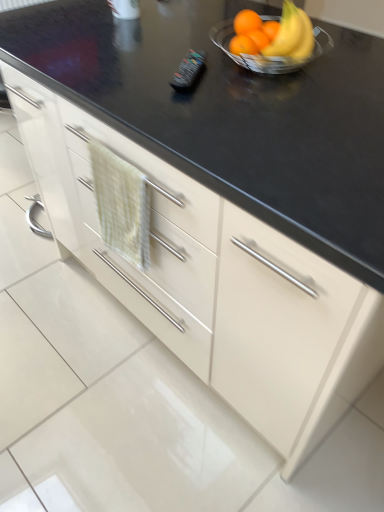
Question: Considering the relative sizes of black plastic remote control at center and shiny metallic bowl at upper right in the image provided, is black plastic remote control at center wider than shiny metallic bowl at upper right?

Choices:
 (A) no
 (B) yes

Answer: (A)

Question: Is black plastic remote control at center behind shiny metallic bowl at upper right?

Choices:
 (A) no
 (B) yes

Answer: (B)

Question: Is black plastic remote control at center with shiny metallic bowl at upper right?

Choices:
 (A) yes
 (B) no

Answer: (B)

Question: Does black plastic remote control at center have a lesser height compared to shiny metallic bowl at upper right?

Choices:
 (A) no
 (B) yes

Answer: (B)

Question: Does black plastic remote control at center turn towards shiny metallic bowl at upper right?

Choices:
 (A) no
 (B) yes

Answer: (A)

Question: Is black plastic remote control at center to the right of shiny metallic bowl at upper right from the viewer's perspective?

Choices:
 (A) yes
 (B) no

Answer: (B)

Question: Can you confirm if orange matte at upper right is thinner than shiny metallic bowl at upper right?

Choices:
 (A) yes
 (B) no

Answer: (A)

Question: Considering the relative sizes of orange matte at upper right and shiny metallic bowl at upper right in the image provided, is orange matte at upper right bigger than shiny metallic bowl at upper right?

Choices:
 (A) no
 (B) yes

Answer: (A)

Question: Can we say orange matte at upper right lies outside shiny metallic bowl at upper right?

Choices:
 (A) no
 (B) yes

Answer: (B)

Question: From a real-world perspective, does orange matte at upper right stand above shiny metallic bowl at upper right?

Choices:
 (A) no
 (B) yes

Answer: (A)

Question: Can you confirm if orange matte at upper right is shorter than shiny metallic bowl at upper right?

Choices:
 (A) no
 (B) yes

Answer: (B)

Question: Are orange matte at upper right and shiny metallic bowl at upper right beside each other?

Choices:
 (A) no
 (B) yes

Answer: (B)

Question: Is black plastic remote control at center positioned behind orange matte at upper right?

Choices:
 (A) no
 (B) yes

Answer: (A)